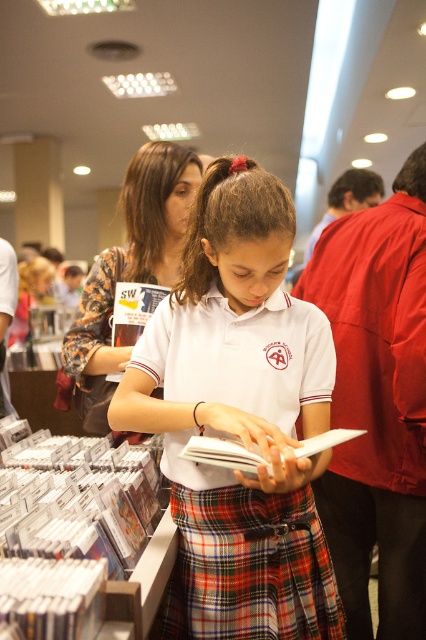
You are a store employee who needs to place the white matte book at center into a display case that can only accommodate items up to the width of the white cotton shirt at center. Can the book fit?

The white cotton shirt at center is wider than the white matte book at center, so the book will fit in the display case since its width is smaller than the shirt.

What is the object located at the coordinates point (239, 419) in the bookstore scene?

The object located at point (239, 419) is the white cotton shirt at center.